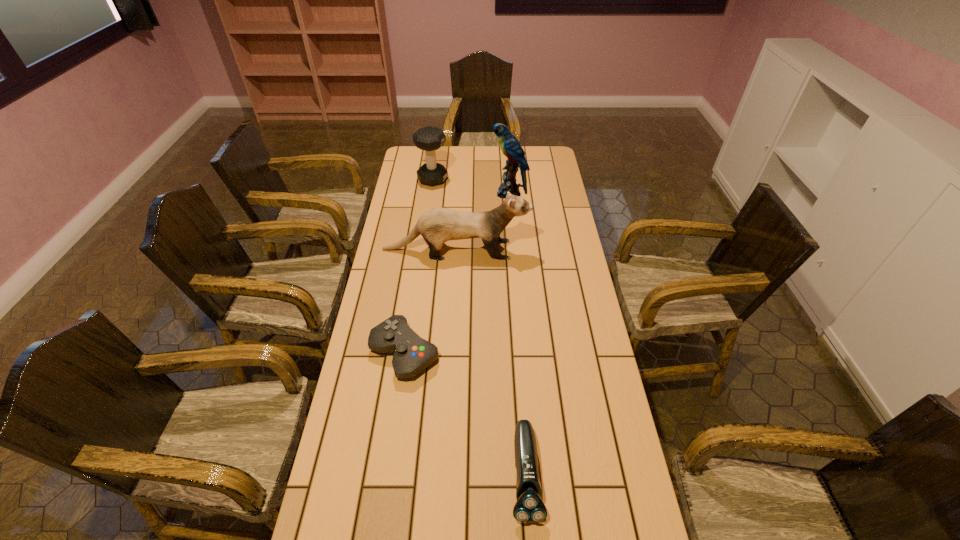
I want to click on the tallest object, so click(510, 146).

This screenshot has width=960, height=540. Find the location of `the third nearest object`. the third nearest object is located at coordinates (438, 225).

At what (x,y) coordinates should I click in order to perform the action: click on dumbbell. Please return your answer as a coordinate pair (x, y). This screenshot has width=960, height=540. Looking at the image, I should click on (429, 138).

Where is `electric shaver`? Image resolution: width=960 pixels, height=540 pixels. electric shaver is located at coordinates (529, 507).

Find the location of a particular element. Image resolution: width=960 pixels, height=540 pixels. control is located at coordinates (412, 354).

At what (x,y) coordinates should I click in order to perform the action: click on vacant point located 0.240m on the face of the parrot. Please return your answer as a coordinate pair (x, y). The height and width of the screenshot is (540, 960). Looking at the image, I should click on (439, 193).

The width and height of the screenshot is (960, 540). Identify the location of blank space located 0.210m on the face of the parrot. (445, 193).

The image size is (960, 540). Identify the location of blank area located on the face of the parrot. (420, 193).

I want to click on blank area located 0.130m on the face of the ferret, so click(x=563, y=250).

Identify the location of vacant position located on the left of the dumbbell. The image size is (960, 540). (407, 179).